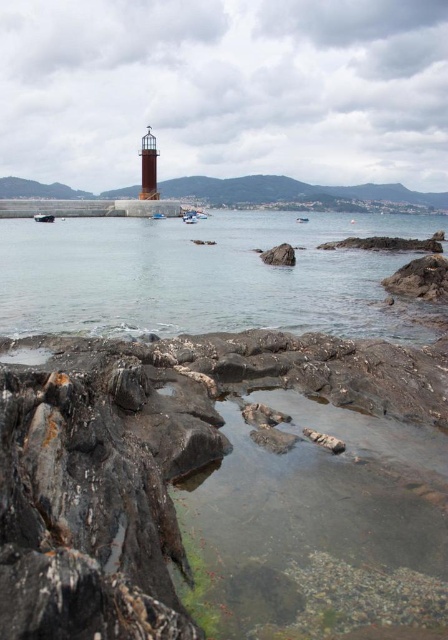
Question: Estimate the real-world distances between objects in this image. Which object is farther from the rough textured rock at center?

Choices:
 (A) blue plastic boat at center
 (B) white plastic boat at center
 (C) clear water at center
 (D) metallic gray boat at lower left

Answer: (A)

Question: Does clear water at center appear over rough textured rock at center?

Choices:
 (A) yes
 (B) no

Answer: (A)

Question: Which point is farther from the camera taking this photo?

Choices:
 (A) (289, 262)
 (B) (39, 212)
 (C) (159, 211)
 (D) (95, 244)

Answer: (C)

Question: Does clear water at center have a smaller size compared to rough textured rock at center?

Choices:
 (A) no
 (B) yes

Answer: (A)

Question: Which of the following is the closest to the observer?

Choices:
 (A) metallic gray boat at lower left
 (B) blue plastic boat at center

Answer: (A)

Question: Can you confirm if clear water at center is smaller than white plastic boat at center?

Choices:
 (A) yes
 (B) no

Answer: (B)